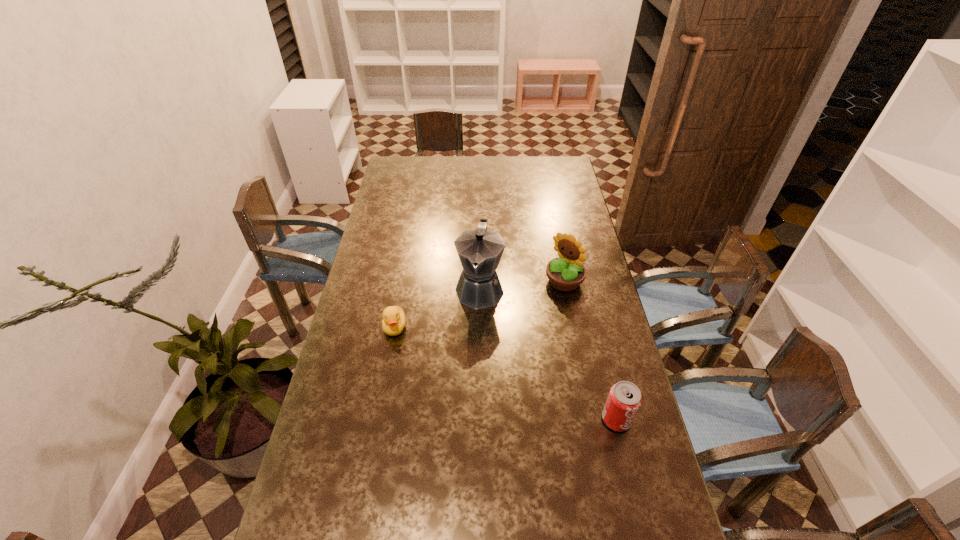
At what (x,y) coordinates should I click in order to perform the action: click on free region at the right edge. Please return your answer as a coordinate pair (x, y). This screenshot has height=540, width=960. Looking at the image, I should click on (587, 250).

The width and height of the screenshot is (960, 540). Find the location of `vacant space at the far right corner`. vacant space at the far right corner is located at coordinates (540, 179).

Locate an element on the screen. Image resolution: width=960 pixels, height=540 pixels. vacant space at the near right corner is located at coordinates (649, 512).

Where is `free space between the third shortest object and the nearest object`? free space between the third shortest object and the nearest object is located at coordinates (590, 350).

Where is `vacant region between the tallest object and the sunflower`? This screenshot has width=960, height=540. vacant region between the tallest object and the sunflower is located at coordinates (522, 285).

Identify the location of unoccupied area between the tallest object and the sunflower. The image size is (960, 540). (522, 285).

At what (x,y) coordinates should I click in order to perform the action: click on empty space between the duckling and the soda can. Please return your answer as a coordinate pair (x, y). This screenshot has height=540, width=960. Looking at the image, I should click on (506, 373).

Where is `empty location between the soda can and the third shortest object`? empty location between the soda can and the third shortest object is located at coordinates (590, 350).

Find the location of a particular element. free space between the nearest object and the second object from left to right is located at coordinates (548, 354).

I want to click on empty space between the nearest object and the third shortest object, so click(x=590, y=350).